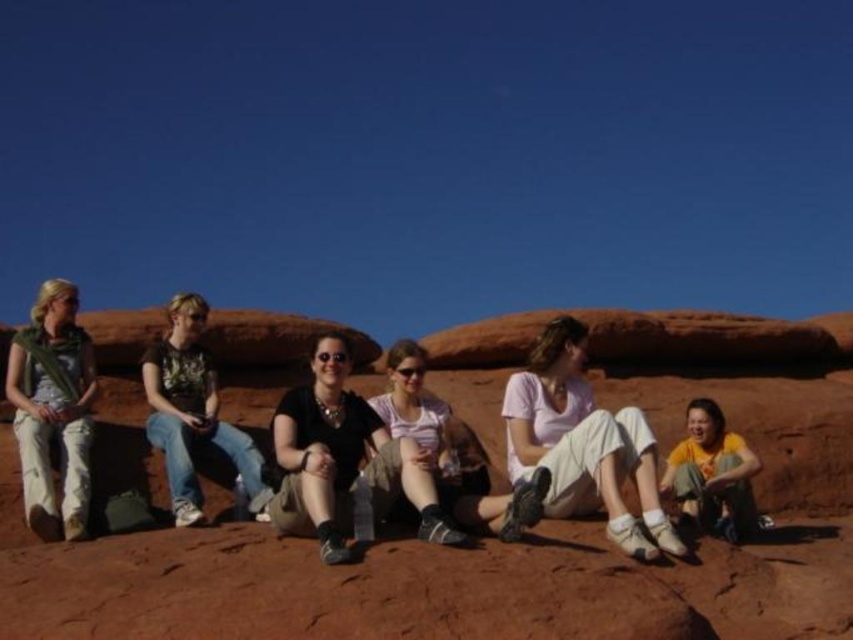
You are a photographer trying to capture a group photo of the six people sitting on the rock formation. You want to ensure that both the green scarf at left and the matte pink shirt at center are visible in the frame. Based on their positions, which object should you focus on first to include both in the shot?

The green scarf at left is to the left of matte pink shirt at center, so focusing on the matte pink shirt at center first would allow you to include both objects in the frame since the green scarf at left is positioned to its left.

You are standing at the point marked as point (408,586) in the image. What object is located exactly at that point?

The point (408,586) is exactly where the reddish brown rock at center is located.